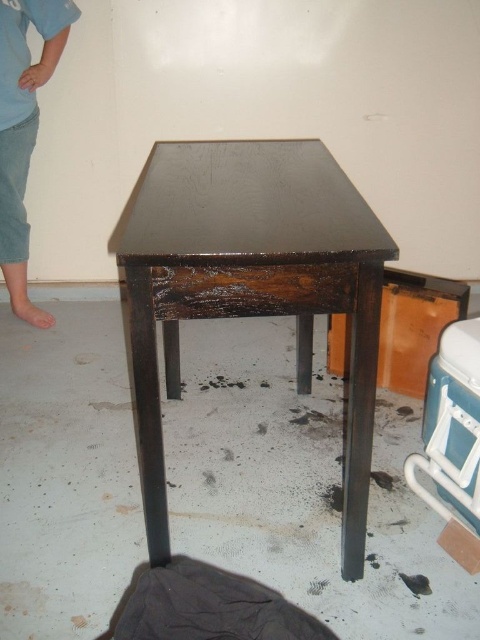
The height and width of the screenshot is (640, 480). What do you see at coordinates (250, 285) in the screenshot?
I see `dark wood table at center` at bounding box center [250, 285].

Is dark wood table at center further to the viewer compared to light blue denim pants at left?

No.

Is point (156, 545) closer to camera compared to point (14, 145)?

That is True.

What are the coordinates of `dark wood table at center` in the screenshot? It's located at (250, 285).